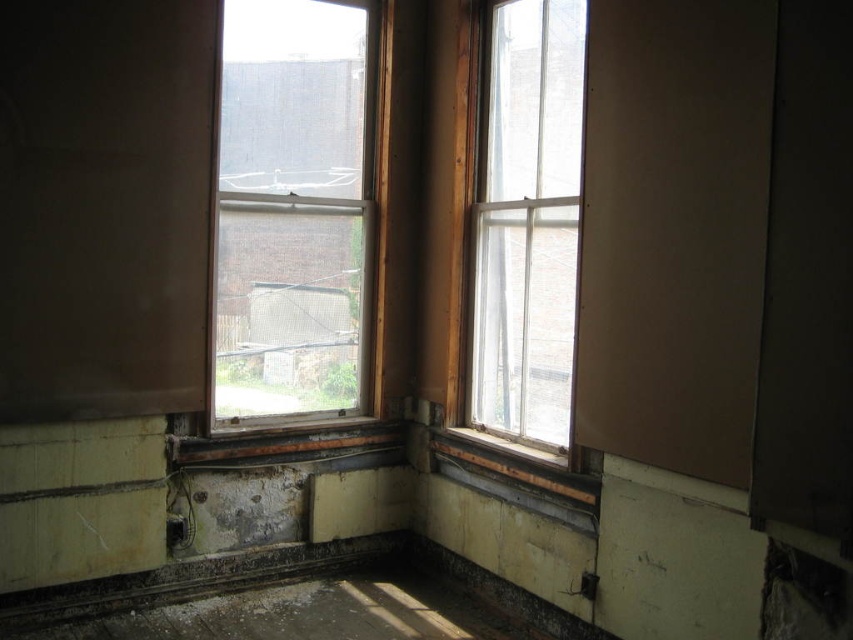
Question: Is clear glass window at center to the right of clear glass window at upper right from the viewer's perspective?

Choices:
 (A) no
 (B) yes

Answer: (A)

Question: Does clear glass window at center appear over clear glass window at upper right?

Choices:
 (A) yes
 (B) no

Answer: (A)

Question: Among these points, which one is nearest to the camera?

Choices:
 (A) (581, 35)
 (B) (370, 236)

Answer: (A)

Question: Which object appears closest to the camera in this image?

Choices:
 (A) clear glass window at center
 (B) clear glass window at upper right

Answer: (B)

Question: Which point appears closest to the camera in this image?

Choices:
 (A) (486, 33)
 (B) (335, 157)

Answer: (A)

Question: Is clear glass window at center closer to camera compared to clear glass window at upper right?

Choices:
 (A) yes
 (B) no

Answer: (B)